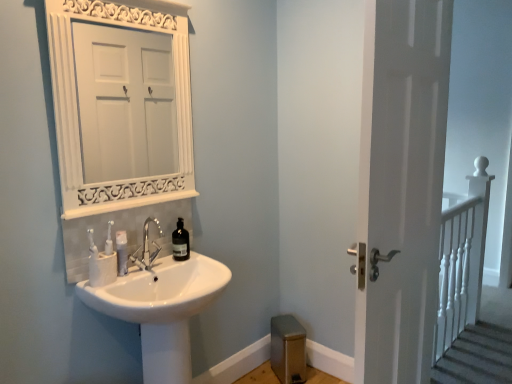
Question: Are white matte door at right and white matte toothpaste tube at sink making contact?

Choices:
 (A) yes
 (B) no

Answer: (B)

Question: Is white matte door at right oriented away from white matte toothpaste tube at sink?

Choices:
 (A) yes
 (B) no

Answer: (B)

Question: Could you tell me if white matte door at right is turned towards white matte toothpaste tube at sink?

Choices:
 (A) no
 (B) yes

Answer: (A)

Question: From the image's perspective, is white matte door at right above white matte toothpaste tube at sink?

Choices:
 (A) yes
 (B) no

Answer: (A)

Question: Can you confirm if white matte door at right is thinner than white matte toothpaste tube at sink?

Choices:
 (A) no
 (B) yes

Answer: (A)

Question: Does white matte door at right have a greater height compared to white matte toothpaste tube at sink?

Choices:
 (A) yes
 (B) no

Answer: (A)

Question: Can you confirm if polished chrome faucet at sink center is bigger than translucent glass bottle at sink?

Choices:
 (A) no
 (B) yes

Answer: (B)

Question: Are polished chrome faucet at sink center and translucent glass bottle at sink making contact?

Choices:
 (A) yes
 (B) no

Answer: (B)

Question: From a real-world perspective, is polished chrome faucet at sink center located beneath translucent glass bottle at sink?

Choices:
 (A) no
 (B) yes

Answer: (A)

Question: From the image's perspective, is polished chrome faucet at sink center on translucent glass bottle at sink?

Choices:
 (A) yes
 (B) no

Answer: (B)

Question: Does polished chrome faucet at sink center have a greater height compared to translucent glass bottle at sink?

Choices:
 (A) yes
 (B) no

Answer: (A)

Question: Is polished chrome faucet at sink center facing away from translucent glass bottle at sink?

Choices:
 (A) no
 (B) yes

Answer: (A)

Question: Considering the relative sizes of white matte toothpaste tube at sink and polished chrome faucet at sink center in the image provided, is white matte toothpaste tube at sink smaller than polished chrome faucet at sink center?

Choices:
 (A) yes
 (B) no

Answer: (A)